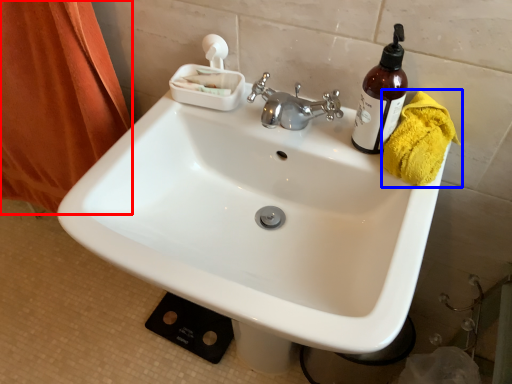
Question: Which point is further to the camera, shower curtain (highlighted by a red box) or bath towel (highlighted by a blue box)?

Choices:
 (A) shower curtain
 (B) bath towel

Answer: (A)